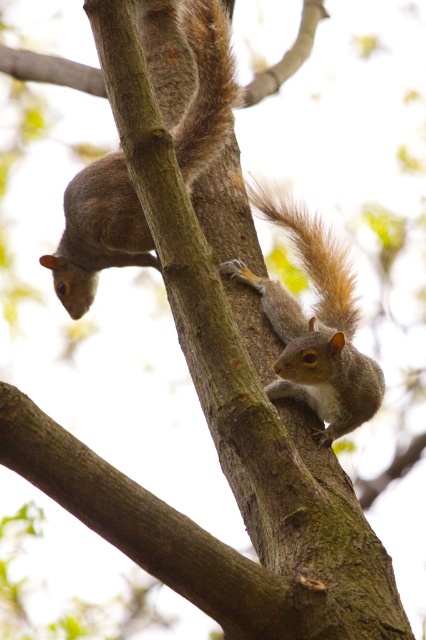
Is the position of gray fur squirrel at center more distant than that of fuzzy brown tail at right?

No.

Can you confirm if gray fur squirrel at center is shorter than fuzzy brown tail at right?

Incorrect, gray fur squirrel at center's height does not fall short of fuzzy brown tail at right's.

Find the location of a particular element. The height and width of the screenshot is (640, 426). gray fur squirrel at center is located at coordinates (97, 232).

From the picture: Does gray fur squirrel at center have a larger size compared to gray furry squirrel at center?

Indeed, gray fur squirrel at center has a larger size compared to gray furry squirrel at center.

What do you see at coordinates (97, 232) in the screenshot?
I see `gray fur squirrel at center` at bounding box center [97, 232].

Identify the location of gray fur squirrel at center. This screenshot has width=426, height=640. (97, 232).

In the scene shown: Can you confirm if gray furry squirrel at center is smaller than fuzzy brown tail at right?

Actually, gray furry squirrel at center might be larger than fuzzy brown tail at right.

Which is in front, point (342, 424) or point (264, 211)?

Positioned in front is point (342, 424).

Identify the location of gray furry squirrel at center. The height and width of the screenshot is (640, 426). (314, 326).